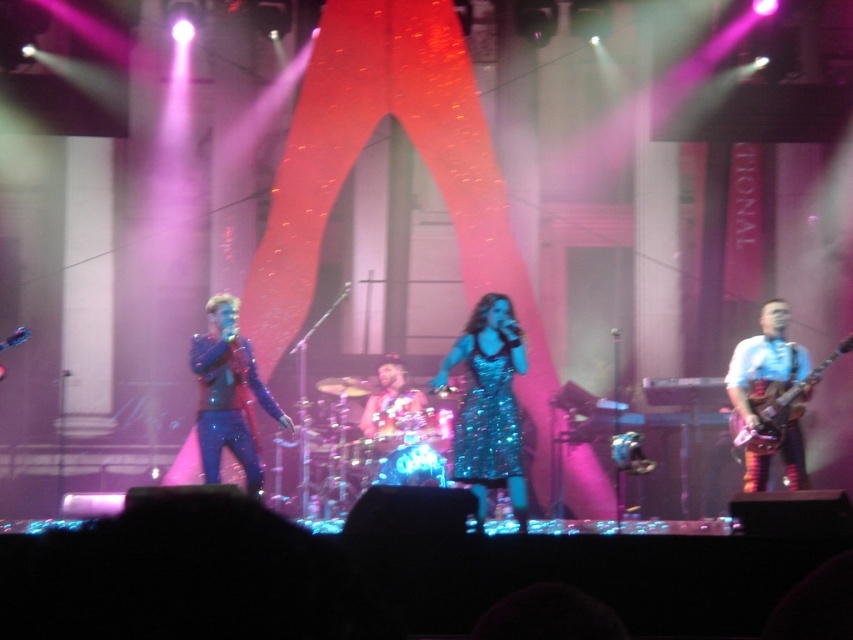
Question: Observing the image, what is the correct spatial positioning of sparkly blue jacket at center in reference to shiny red guitar at right?

Choices:
 (A) above
 (B) below

Answer: (B)

Question: Which is farther from the sparkly blue jacket at center?

Choices:
 (A) shiny red guitar at right
 (B) shiny metallic drum set at center
 (C) sparkly teal dress at center

Answer: (A)

Question: Does sparkly blue jacket at center appear on the left side of shiny red guitar at right?

Choices:
 (A) no
 (B) yes

Answer: (B)

Question: Considering the real-world distances, which object is farthest from the sparkly teal dress at center?

Choices:
 (A) sparkly blue jacket at center
 (B) shiny red guitar at right

Answer: (B)

Question: Does sparkly blue jacket at center have a larger size compared to shiny metallic drum set at center?

Choices:
 (A) no
 (B) yes

Answer: (B)

Question: Which object is positioned closest to the shiny metallic drum set at center?

Choices:
 (A) sparkly blue jacket at center
 (B) shiny red guitar at right

Answer: (A)